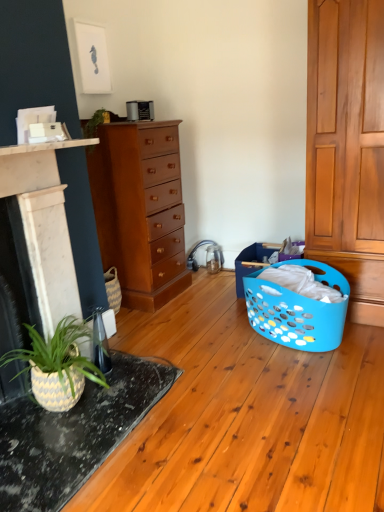
Question: Is blue plastic laundry basket at lower right located outside mahogany wood chest of drawers at center?

Choices:
 (A) yes
 (B) no

Answer: (A)

Question: From the image's perspective, is blue plastic laundry basket at lower right beneath mahogany wood chest of drawers at center?

Choices:
 (A) no
 (B) yes

Answer: (B)

Question: Is blue plastic laundry basket at lower right facing away from mahogany wood chest of drawers at center?

Choices:
 (A) no
 (B) yes

Answer: (A)

Question: Is the depth of blue plastic laundry basket at lower right less than that of mahogany wood chest of drawers at center?

Choices:
 (A) yes
 (B) no

Answer: (A)

Question: Are blue plastic laundry basket at lower right and mahogany wood chest of drawers at center located far from each other?

Choices:
 (A) no
 (B) yes

Answer: (A)

Question: Can you confirm if blue plastic laundry basket at lower right is thinner than mahogany wood chest of drawers at center?

Choices:
 (A) no
 (B) yes

Answer: (A)

Question: Is speckled ceramic table at lower left taller than blue plastic laundry basket at lower right?

Choices:
 (A) no
 (B) yes

Answer: (A)

Question: From a real-world perspective, is speckled ceramic table at lower left positioned over blue plastic laundry basket at lower right based on gravity?

Choices:
 (A) no
 (B) yes

Answer: (A)

Question: Is speckled ceramic table at lower left closer to camera compared to blue plastic laundry basket at lower right?

Choices:
 (A) yes
 (B) no

Answer: (A)

Question: Is speckled ceramic table at lower left outside blue plastic laundry basket at lower right?

Choices:
 (A) yes
 (B) no

Answer: (A)

Question: Is speckled ceramic table at lower left looking in the opposite direction of blue plastic laundry basket at lower right?

Choices:
 (A) no
 (B) yes

Answer: (A)

Question: Would you say speckled ceramic table at lower left is a long distance from blue plastic laundry basket at lower right?

Choices:
 (A) no
 (B) yes

Answer: (A)

Question: From the image's perspective, is mahogany wood chest of drawers at center under speckled ceramic table at lower left?

Choices:
 (A) no
 (B) yes

Answer: (A)